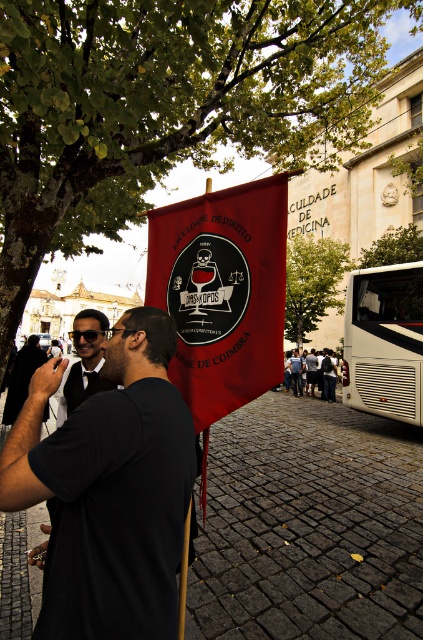
Is white metallic bus at right below matte black sunglasses at center?

Incorrect, white metallic bus at right is not positioned below matte black sunglasses at center.

Can you confirm if white metallic bus at right is smaller than matte black sunglasses at center?

Correct, white metallic bus at right occupies less space than matte black sunglasses at center.

Is point (368, 301) closer to viewer compared to point (95, 374)?

No, it is behind (95, 374).

Image resolution: width=423 pixels, height=640 pixels. In order to click on white metallic bus at right in this screenshot , I will do `click(384, 340)`.

Is red matte flag at center bigger than white metallic bus at right?

No, red matte flag at center is not bigger than white metallic bus at right.

Which is behind, point (189, 276) or point (417, 339)?

The point (417, 339) is more distant.

The height and width of the screenshot is (640, 423). Identify the location of red matte flag at center. (222, 292).

Does point (68, 458) come in front of point (241, 198)?

Yes, it is.

Can you confirm if black matte t-shirt at center is positioned to the left of red matte flag at center?

Indeed, black matte t-shirt at center is positioned on the left side of red matte flag at center.

Does point (156, 451) come farther from viewer compared to point (260, 296)?

No.

The height and width of the screenshot is (640, 423). What are the coordinates of `black matte t-shirt at center` in the screenshot? It's located at (109, 490).